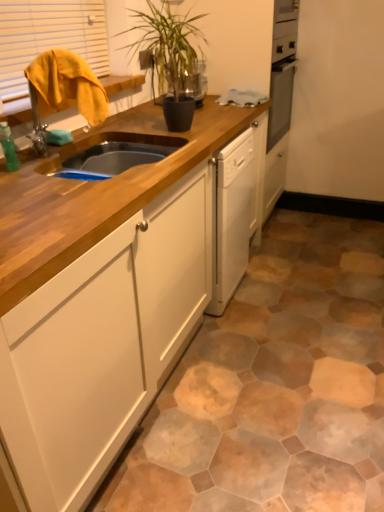
The width and height of the screenshot is (384, 512). What are the coordinates of `vacant area located to the right-hand side of green matte bottle at left` in the screenshot? It's located at (52, 167).